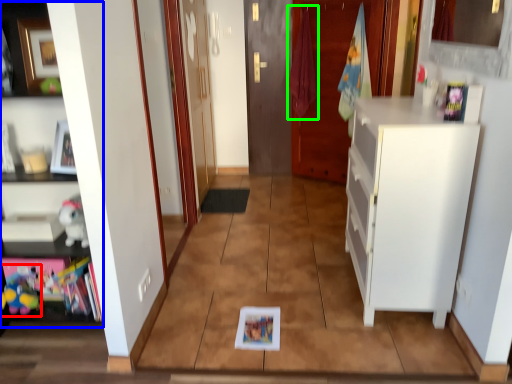
Question: Which is farther away from toy (highlighted by a red box)? cabinetry (highlighted by a blue box) or laundry (highlighted by a green box)?

Choices:
 (A) cabinetry
 (B) laundry

Answer: (B)